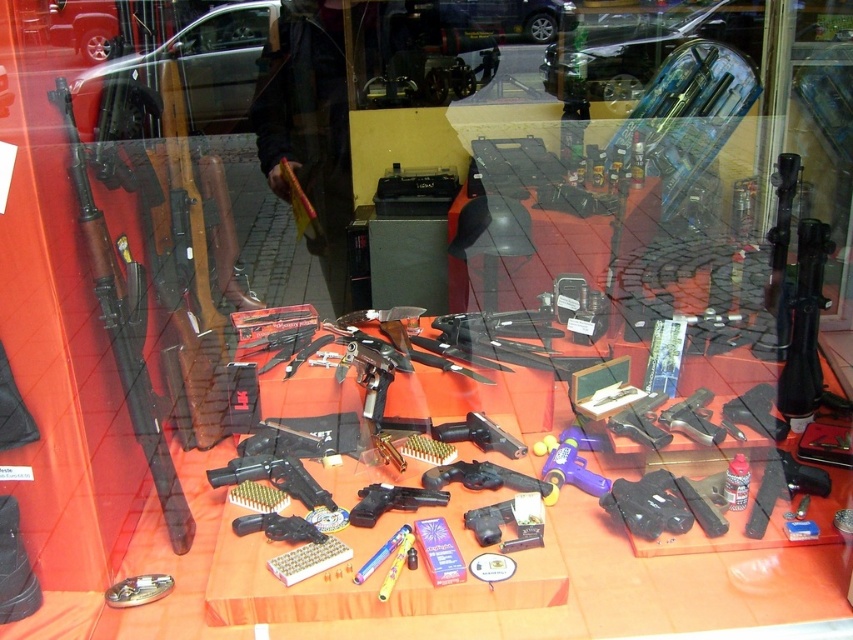
Can you confirm if wooden rifle at left is bigger than matte black handgun at center?

Indeed, wooden rifle at left has a larger size compared to matte black handgun at center.

How distant is wooden rifle at left from matte black handgun at center?

They are 21.09 inches apart.

Does point (128, 364) come closer to viewer compared to point (370, 500)?

Yes.

Identify the location of wooden rifle at left. (125, 332).

Consider the image. Does wooden rifle at left have a larger size compared to polished black handgun at center?

Indeed, wooden rifle at left has a larger size compared to polished black handgun at center.

Does wooden rifle at left have a smaller size compared to polished black handgun at center?

Actually, wooden rifle at left might be larger than polished black handgun at center.

Where is `wooden rifle at left`? This screenshot has width=853, height=640. wooden rifle at left is located at coordinates (125, 332).

Who is shorter, polished black handgun at center or matte black handgun at center?

matte black handgun at center

Which of these two, polished black handgun at center or matte black handgun at center, stands taller?

With more height is polished black handgun at center.

Which is behind, point (263, 464) or point (392, 504)?

The point (263, 464) is more distant.

Locate an element on the screen. Image resolution: width=853 pixels, height=640 pixels. polished black handgun at center is located at coordinates (274, 477).